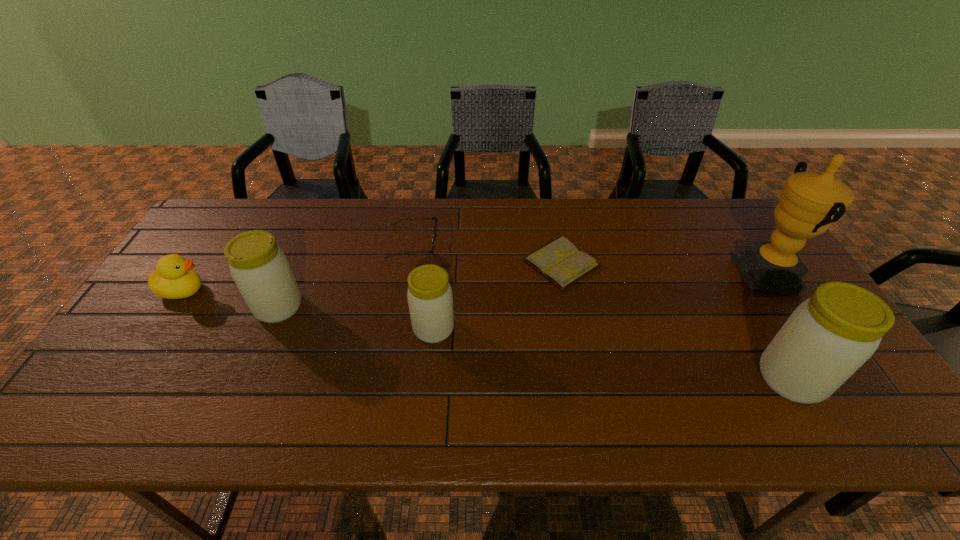
At what (x,y) coordinates should I click in order to perform the action: click on vacant space positioned at the beak of the duck. Please return your answer as a coordinate pair (x, y). The height and width of the screenshot is (540, 960). Looking at the image, I should click on (x=324, y=291).

You are a GUI agent. You are given a task and a screenshot of the screen. Output one action in this format:
    pyautogui.click(x=<x>, y=<y>)
    Task: Click on the spectacles situated at the far edge
    The width and height of the screenshot is (960, 540).
    Given the screenshot: What is the action you would take?
    pyautogui.click(x=435, y=226)

The height and width of the screenshot is (540, 960). Identify the location of diary that is at the far edge. (560, 262).

This screenshot has width=960, height=540. Identify the location of object that is at the near edge. (828, 337).

This screenshot has height=540, width=960. Identify the location of object at the left edge. (174, 278).

Locate an element on the screen. Image resolution: width=960 pixels, height=540 pixels. jar present at the right edge is located at coordinates (828, 337).

Identify the location of award positioned at the right edge. The width and height of the screenshot is (960, 540). (810, 202).

At what (x,y) coordinates should I click in order to perform the action: click on object that is at the near right corner. Please return your answer as a coordinate pair (x, y). Looking at the image, I should click on (828, 337).

In the image, there is a desktop. In order to click on vacant area at the far edge in this screenshot , I will do `click(577, 238)`.

Image resolution: width=960 pixels, height=540 pixels. I want to click on vacant space at the left edge of the desktop, so click(x=163, y=362).